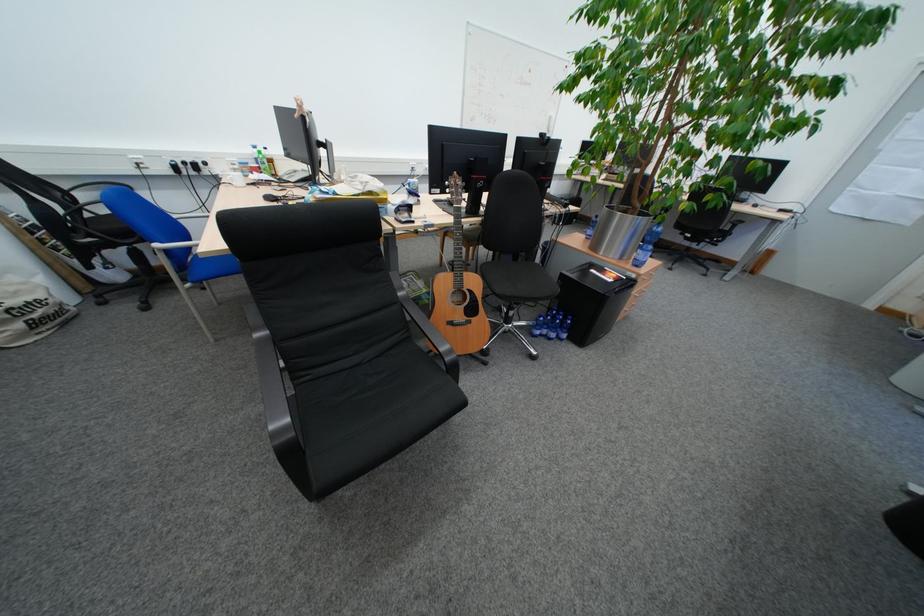
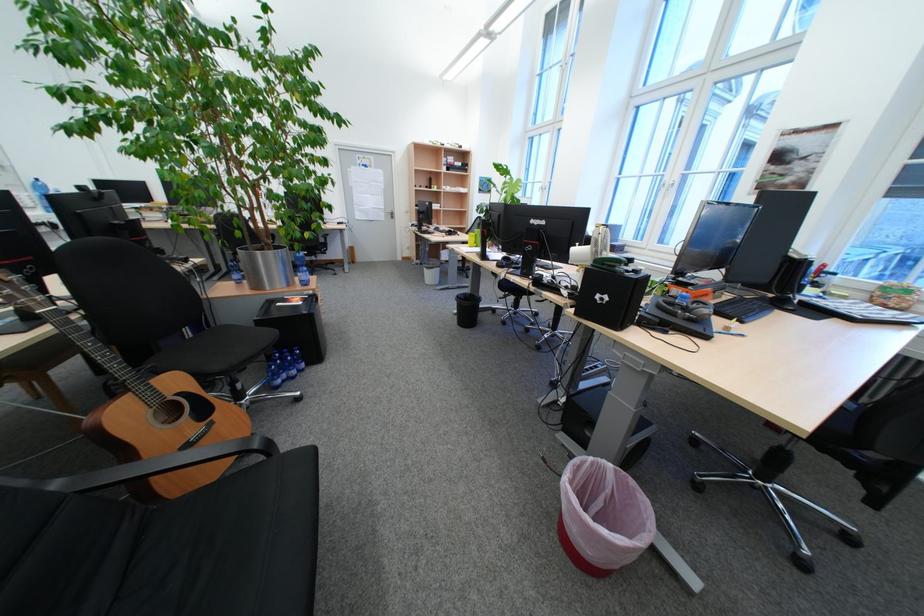
Where in the second image is the point corresponding to (x=458, y=371) from the first image?

(281, 456)